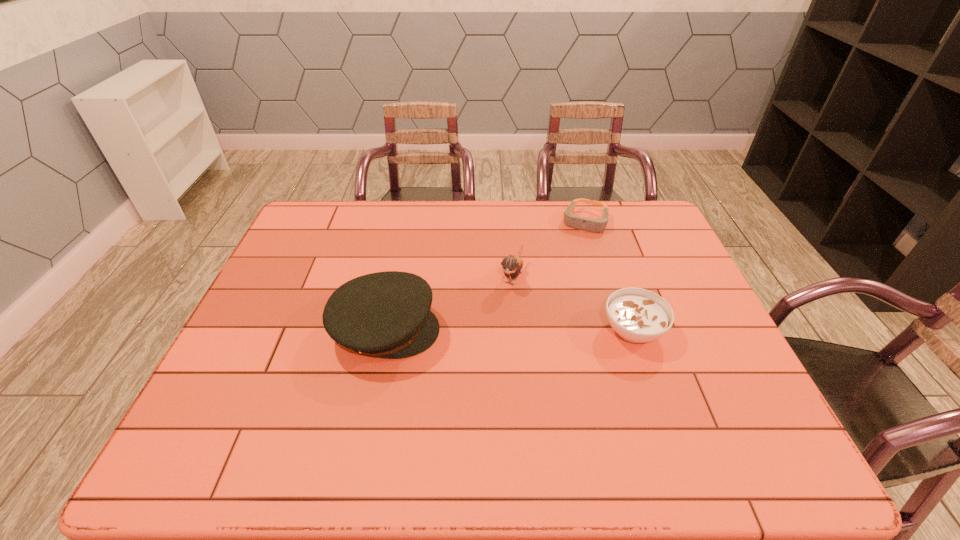
This screenshot has width=960, height=540. I want to click on vacant space at the right edge, so [641, 271].

Locate an element on the screen. The image size is (960, 540). free location at the far right corner of the desktop is located at coordinates (649, 220).

Where is `vacant space at the near right corner of the desktop`? vacant space at the near right corner of the desktop is located at coordinates (704, 390).

Identify the location of free area in between the goggles and the third object from right to left. (548, 249).

Find the location of `vacant point located between the tallest object and the kitten`. vacant point located between the tallest object and the kitten is located at coordinates (448, 303).

Where is `unoccupied position between the second shortest object and the second object from left to right`? Image resolution: width=960 pixels, height=540 pixels. unoccupied position between the second shortest object and the second object from left to right is located at coordinates (572, 303).

This screenshot has height=540, width=960. Find the location of `free space between the goggles and the third tallest object`. free space between the goggles and the third tallest object is located at coordinates (610, 276).

Locate an element on the screen. free point between the beret and the third shortest object is located at coordinates (448, 303).

I want to click on free space between the third nearest object and the tallest object, so click(x=448, y=303).

Where is `free space between the second shortest object and the goggles`? The height and width of the screenshot is (540, 960). free space between the second shortest object and the goggles is located at coordinates (610, 276).